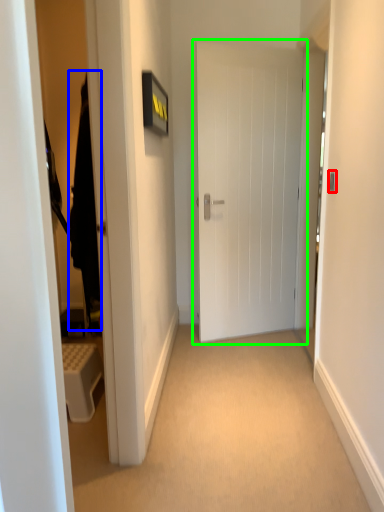
Question: Which object is positioned farthest from door handle (highlighted by a red box)? Select from robe (highlighted by a blue box) and door (highlighted by a green box).

Choices:
 (A) robe
 (B) door

Answer: (B)